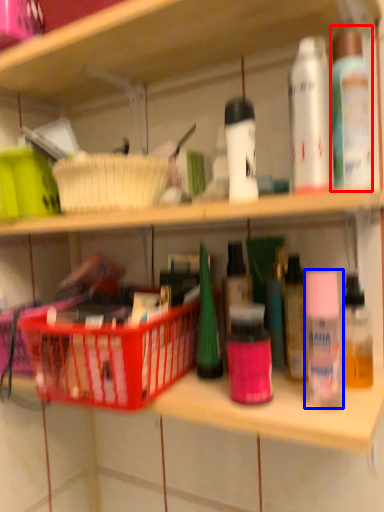
Question: Which object is closer to the camera taking this photo, toiletry (highlighted by a red box) or toiletry (highlighted by a blue box)?

Choices:
 (A) toiletry
 (B) toiletry

Answer: (B)